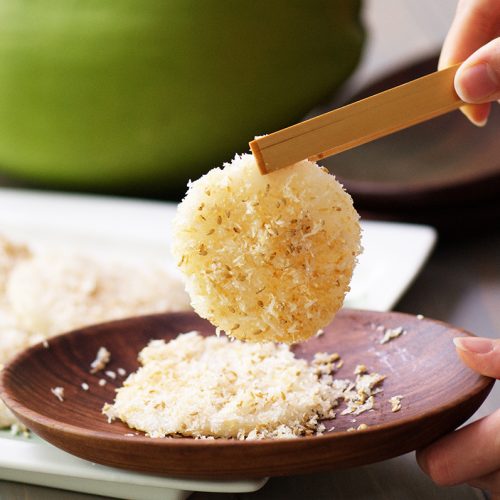
You are a GUI agent. You are given a task and a screenshot of the screen. Output one action in this format:
    pyautogui.click(x=<x>, y=<y>)
    Task: Click on the square plate
    
    Given the screenshot: What is the action you would take?
    pyautogui.click(x=114, y=213)